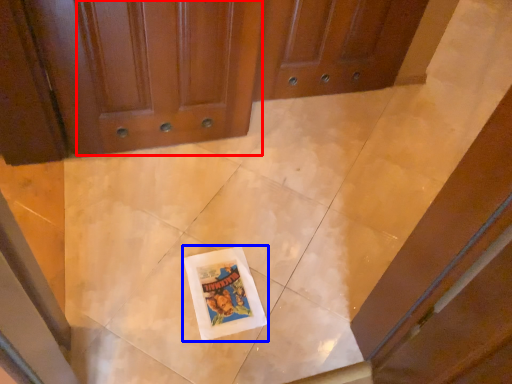
Question: Which point is closer to the camera, door (highlighted by a red box) or comic book (highlighted by a blue box)?

Choices:
 (A) door
 (B) comic book

Answer: (A)